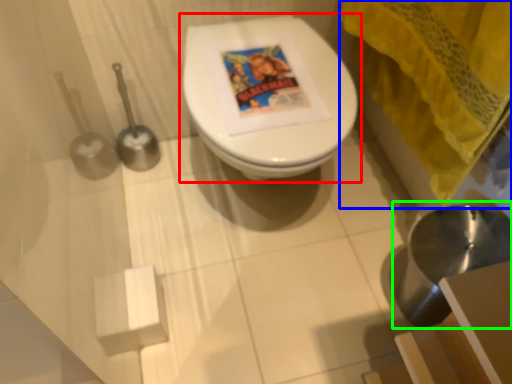
Question: Which object is positioned closest to toilet (highlighted by a red box)? Select from curtain (highlighted by a blue box) and sink (highlighted by a green box).

Choices:
 (A) curtain
 (B) sink

Answer: (A)